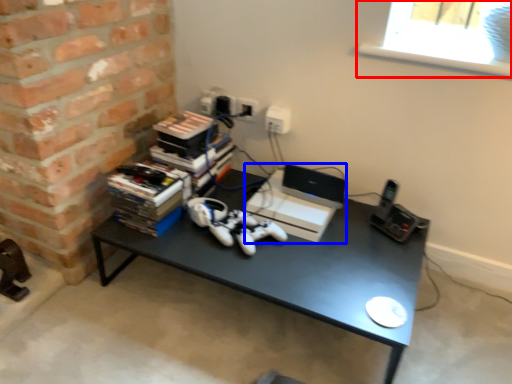
Question: Which point is further to the camera, window screen (highlighted by a red box) or computer (highlighted by a blue box)?

Choices:
 (A) window screen
 (B) computer

Answer: (B)